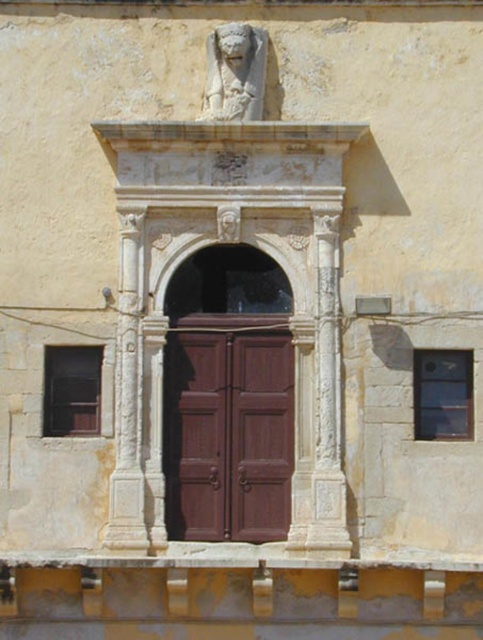
Question: Does white stone lion at upper center appear over clear glass window at upper right?

Choices:
 (A) yes
 (B) no

Answer: (A)

Question: Which point is farther to the camera?

Choices:
 (A) brown wooden door at center
 (B) clear glass window at upper right
 (C) white stone lion at upper center
 (D) dark glass window at left

Answer: (B)

Question: Can you confirm if brown wooden door at center is positioned to the left of dark glass window at left?

Choices:
 (A) no
 (B) yes

Answer: (A)

Question: Which object is farther from the camera taking this photo?

Choices:
 (A) brown wooden door at center
 (B) dark glass window at left
 (C) clear glass window at upper right

Answer: (C)

Question: Which point is farther from the camera taking this photo?

Choices:
 (A) (86, 400)
 (B) (441, 422)

Answer: (A)

Question: Does white stone lion at upper center appear on the left side of dark glass window at left?

Choices:
 (A) no
 (B) yes

Answer: (A)